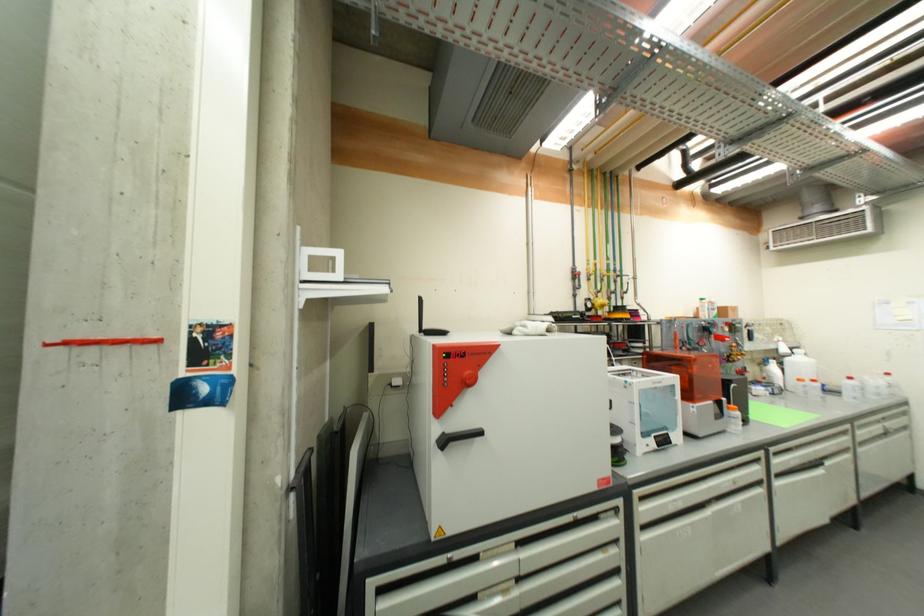
At what (x,y) coordinates should I click in order to perform the action: click on red valve handle. Please return your answer as a coordinate pair (x, y). The width and height of the screenshot is (924, 616). Looking at the image, I should click on (466, 382).